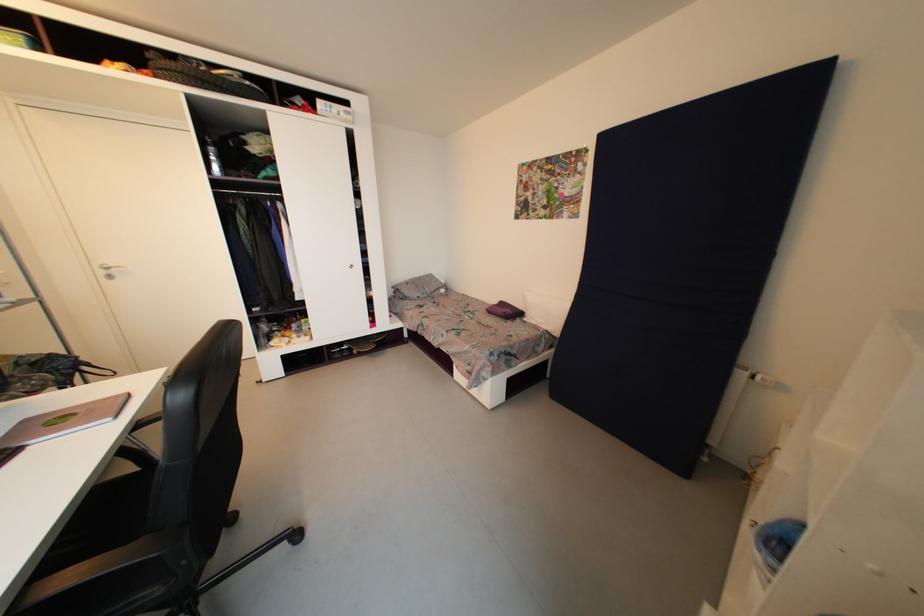
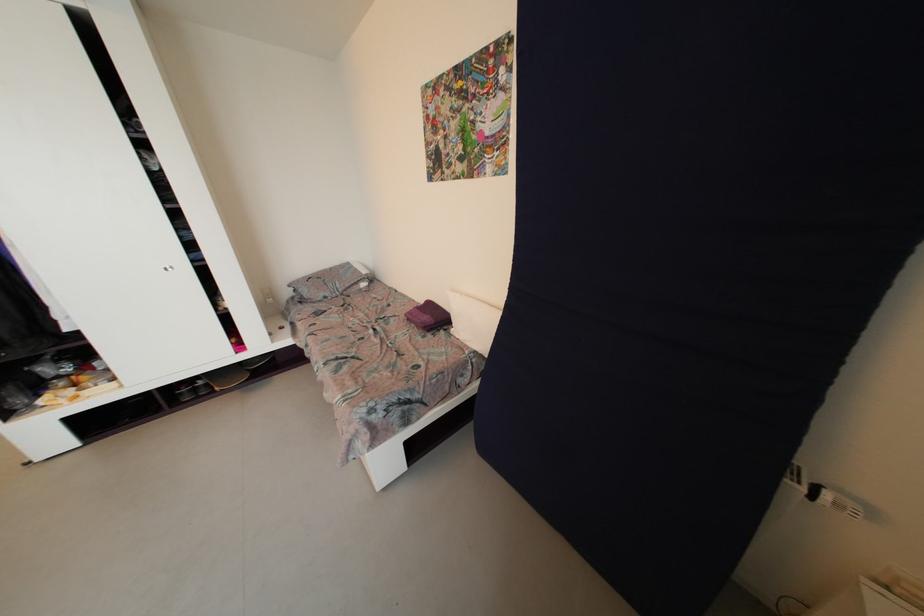
Locate, in the second image, the point that corresponds to point 335,349 in the first image.

(175, 391)